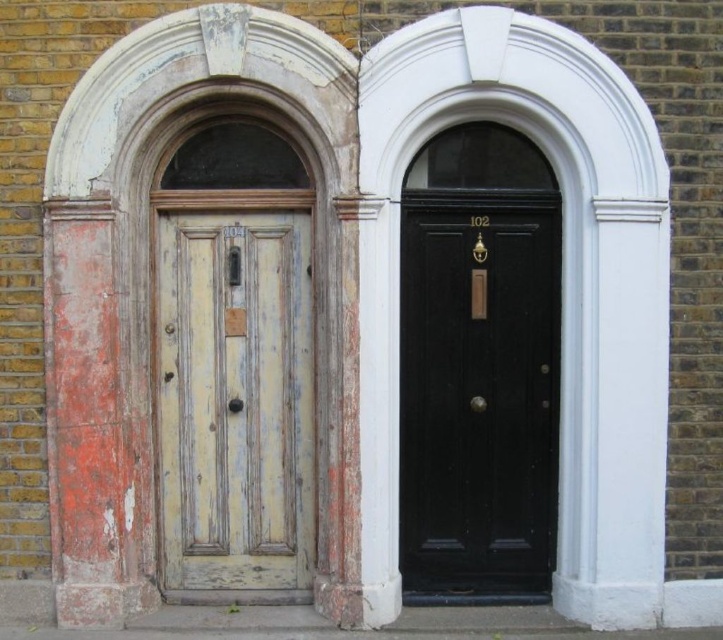
Question: Is black polished wood door at center in front of yellowish wood door at center?

Choices:
 (A) no
 (B) yes

Answer: (B)

Question: Is black polished wood door at center smaller than yellowish wood door at center?

Choices:
 (A) no
 (B) yes

Answer: (A)

Question: Which point is farther to the camera?

Choices:
 (A) (521, 557)
 (B) (189, 348)

Answer: (A)

Question: In this image, where is black polished wood door at center located relative to yellowish wood door at center?

Choices:
 (A) left
 (B) right

Answer: (B)

Question: Which point is closer to the camera?

Choices:
 (A) (231, 326)
 (B) (440, 550)

Answer: (A)